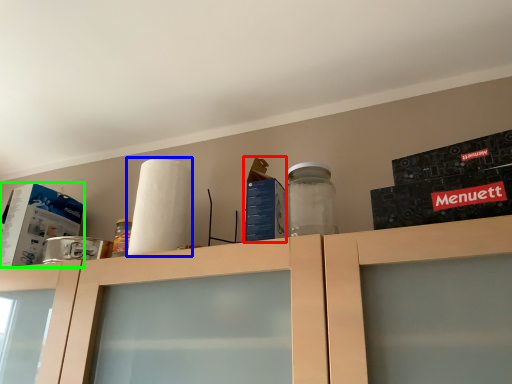
Question: Estimate the real-world distances between objects in this image. Which object is closer to box (highlighted by a red box), paper towel (highlighted by a blue box) or box (highlighted by a green box)?

Choices:
 (A) paper towel
 (B) box

Answer: (A)